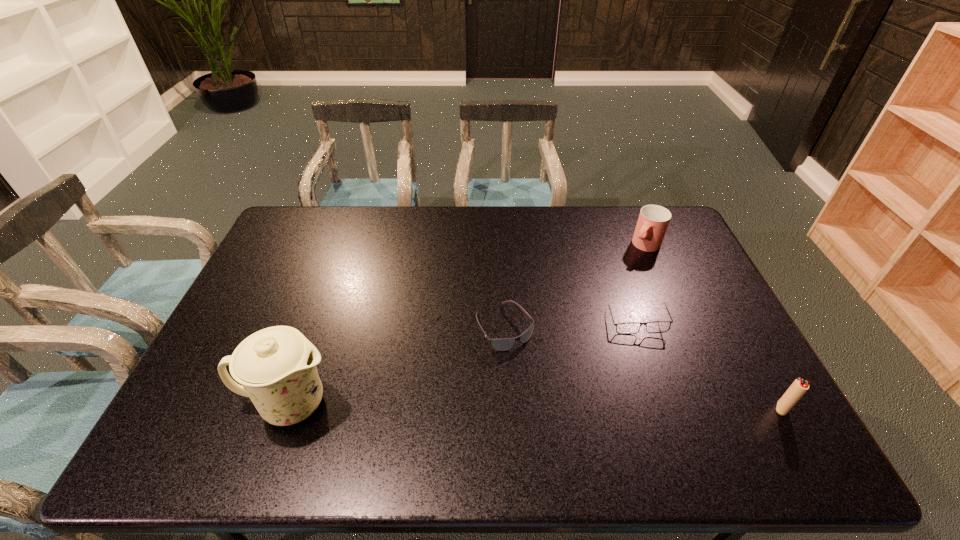
At what (x,y) coordinates should I click in order to perform the action: click on free spot on the desktop that is between the leftmost object and the igniter and is positioned with the lenses facing outward on the spectacles. Please return your answer as a coordinate pair (x, y). The image size is (960, 540). Looking at the image, I should click on (602, 407).

Where is `vacant space on the desktop that is between the leftmost object and the rightmost object and is positioned on the side of the cup with the handle`? Image resolution: width=960 pixels, height=540 pixels. vacant space on the desktop that is between the leftmost object and the rightmost object and is positioned on the side of the cup with the handle is located at coordinates (503, 406).

The width and height of the screenshot is (960, 540). What are the coordinates of `vacant space on the desktop that is between the tallest object and the igniter and is positioned on the lenses of the fourth object from right to left` in the screenshot? It's located at (564, 406).